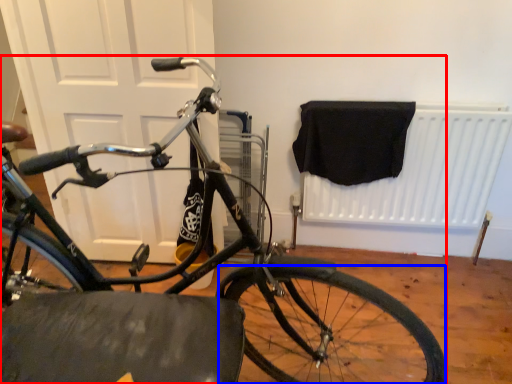
Question: Which of the following is the farthest to the observer, bicycle (highlighted by a red box) or bicycle wheel (highlighted by a blue box)?

Choices:
 (A) bicycle
 (B) bicycle wheel

Answer: (B)